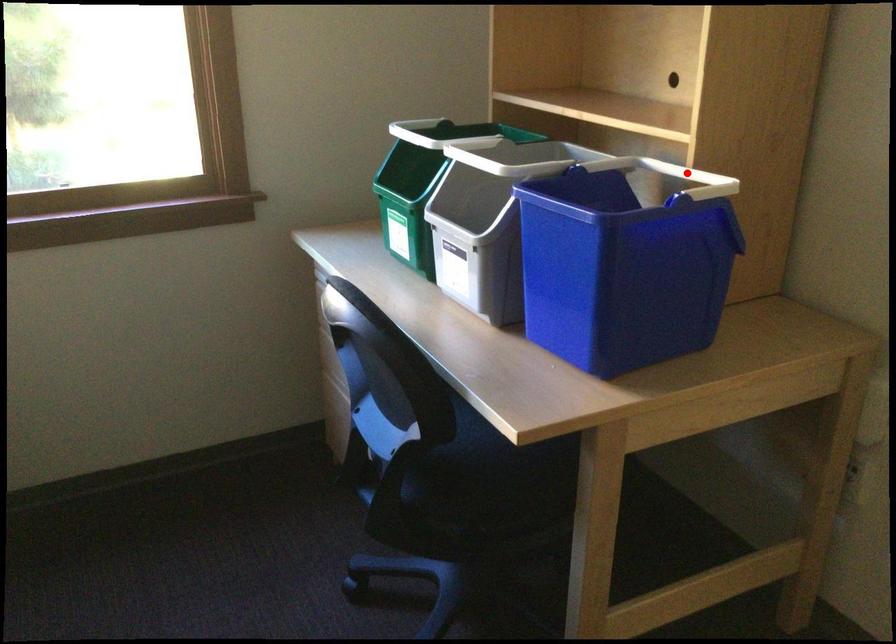
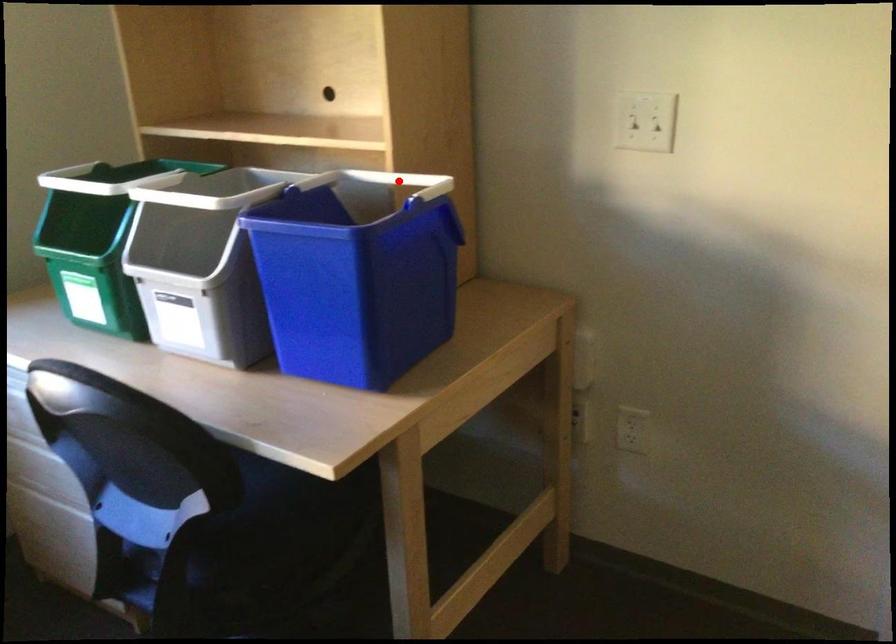
I am providing you with two images of the same scene from different viewpoints. A red point is marked on the first image and another point is marked on the second image. Are the points marked in image1 and image2 representing the same 3D position?

Yes